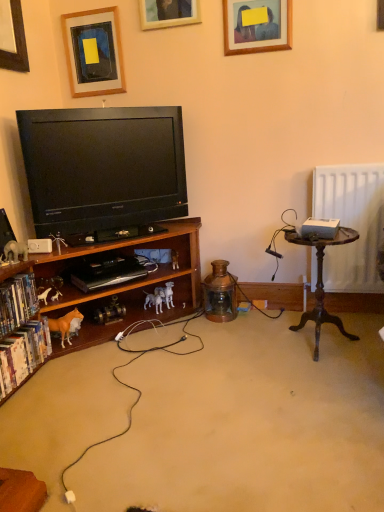
Image resolution: width=384 pixels, height=512 pixels. Find the location of `empty space that is to the right of white plastic dog at lower center, placed as the 4th toy when sorted from front to back`. empty space that is to the right of white plastic dog at lower center, placed as the 4th toy when sorted from front to back is located at coordinates (184, 316).